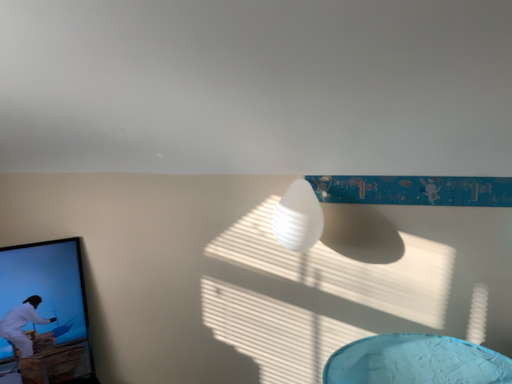
In order to click on white matte lamp at center in this screenshot , I will do `click(298, 217)`.

What do you see at coordinates (298, 217) in the screenshot?
I see `white matte lamp at center` at bounding box center [298, 217].

What is the approximate height of black glossy picture frame at left?

The height of black glossy picture frame at left is 66.39 centimeters.

Identify the location of black glossy picture frame at left. This screenshot has height=384, width=512. (45, 312).

Describe the element at coordinates (45, 312) in the screenshot. I see `black glossy picture frame at left` at that location.

Locate an element on the screen. white matte lamp at center is located at coordinates (298, 217).

Visually, is white matte lamp at center positioned to the left or to the right of black glossy picture frame at left?

In the image, white matte lamp at center appears on the right side of black glossy picture frame at left.

Considering their positions, is white matte lamp at center located in front of or behind black glossy picture frame at left?

Visually, white matte lamp at center is located in front of black glossy picture frame at left.

Between point (319, 223) and point (36, 366), which one is positioned in front?

The point (319, 223) is closer to the camera.

From the picture: From the image's perspective, is white matte lamp at center above black glossy picture frame at left?

Indeed, from the image's perspective, white matte lamp at center is shown above black glossy picture frame at left.

From a real-world perspective, is white matte lamp at center located beneath black glossy picture frame at left?

No, from a real-world perspective, white matte lamp at center is not below black glossy picture frame at left.

Considering the relative sizes of white matte lamp at center and black glossy picture frame at left in the image provided, is white matte lamp at center thinner than black glossy picture frame at left?

Indeed, white matte lamp at center has a lesser width compared to black glossy picture frame at left.

From their relative heights in the image, would you say white matte lamp at center is taller or shorter than black glossy picture frame at left?

In the image, white matte lamp at center appears to be shorter than black glossy picture frame at left.

Between white matte lamp at center and black glossy picture frame at left, which one has larger size?

black glossy picture frame at left.

Would you say white matte lamp at center is inside or outside black glossy picture frame at left?

white matte lamp at center is located beyond the bounds of black glossy picture frame at left.

Are white matte lamp at center and black glossy picture frame at left beside each other?

No, white matte lamp at center is not beside black glossy picture frame at left.

Is white matte lamp at center oriented away from black glossy picture frame at left?

No, black glossy picture frame at left is not at the back of white matte lamp at center.

How many degrees apart are the facing directions of white matte lamp at center and black glossy picture frame at left?

They differ by 48.1 degrees in their facing directions.

Locate an element on the screen. Image resolution: width=512 pixels, height=384 pixels. picture frame on the left side of white matte lamp at center is located at coordinates (45, 312).

Considering the relative positions of black glossy picture frame at left and white matte lamp at center in the image provided, is black glossy picture frame at left to the left of white matte lamp at center from the viewer's perspective?

Indeed, black glossy picture frame at left is positioned on the left side of white matte lamp at center.

Who is more distant, black glossy picture frame at left or white matte lamp at center?

black glossy picture frame at left is behind.

Which is nearer, (76, 364) or (314, 236)?

Point (76, 364) is farther from the camera than point (314, 236).

From the image's perspective, which one is positioned lower, black glossy picture frame at left or white matte lamp at center?

black glossy picture frame at left appears lower in the image.

From a real-world perspective, who is located higher, black glossy picture frame at left or white matte lamp at center?

white matte lamp at center.

Is black glossy picture frame at left wider than white matte lamp at center?

Yes.

From their relative heights in the image, would you say black glossy picture frame at left is taller or shorter than white matte lamp at center?

Clearly, black glossy picture frame at left is taller compared to white matte lamp at center.

Can you confirm if black glossy picture frame at left is smaller than white matte lamp at center?

Incorrect, black glossy picture frame at left is not smaller in size than white matte lamp at center.

Is white matte lamp at center located within black glossy picture frame at left?

No.

Are black glossy picture frame at left and white matte lamp at center beside each other?

No, black glossy picture frame at left is not next to white matte lamp at center.

Is black glossy picture frame at left oriented away from white matte lamp at center?

No, black glossy picture frame at left is not facing the opposite direction of white matte lamp at center.

How many degrees apart are the facing directions of black glossy picture frame at left and white matte lamp at center?

There is a 48.1-degree angle between the facing directions of black glossy picture frame at left and white matte lamp at center.

Where is `picture frame below the white matte lamp at center (from the image's perspective)`? Image resolution: width=512 pixels, height=384 pixels. picture frame below the white matte lamp at center (from the image's perspective) is located at coordinates (45, 312).

Locate an element on the screen. The height and width of the screenshot is (384, 512). picture frame that is on the left side of white matte lamp at center is located at coordinates (45, 312).

The width and height of the screenshot is (512, 384). I want to click on picture frame located underneath the white matte lamp at center (from a real-world perspective), so 45,312.